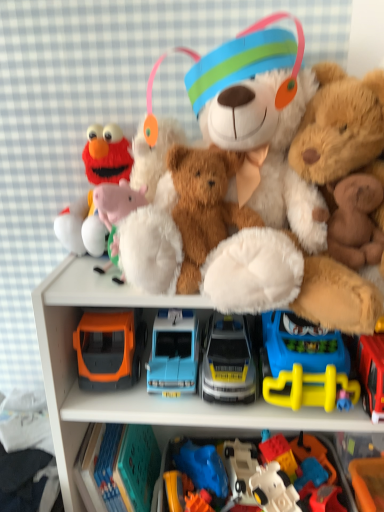
At what (x,y) coordinates should I click in order to perform the action: click on free spot in front of velvet plush elmo at upper left, the first toy viewed from the left. Please return your answer as a coordinate pair (x, y). The image size is (384, 512). Looking at the image, I should click on (77, 282).